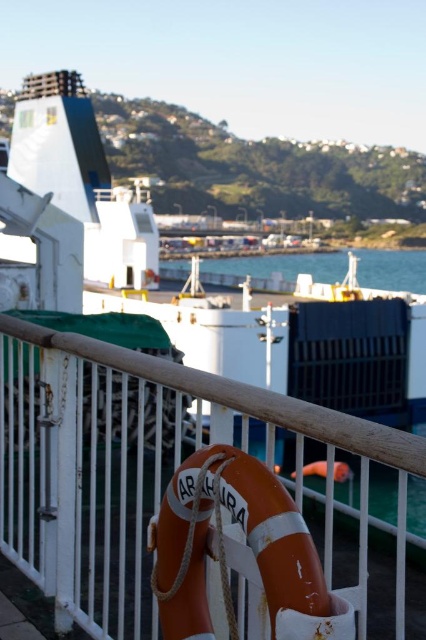
You are standing on the ferry deck and want to take a photo of the blue water at center without including the white metal fence at center. Which direction should you move to ensure the fence is out of frame?

Move to the right side of the ferry deck so that the white metal fence at center is no longer in the frame to the left of blue water at center.

You are standing on the ferry deck and want to secure your bag between the white metal fence at center and the orange matte life jacket at center. Which object should you place your bag closer to if you want it to be on the left side?

The orange matte life jacket at center is on the left side of the white metal fence at center, so placing the bag closer to the orange matte life jacket at center would position it on the left side.

You are standing on the deck of a ferry and notice the white metal fence at center and the blue water at center. Which object appears narrower from your viewpoint?

The white metal fence at center has a lesser width compared to the blue water at center, so the white metal fence at center appears narrower.